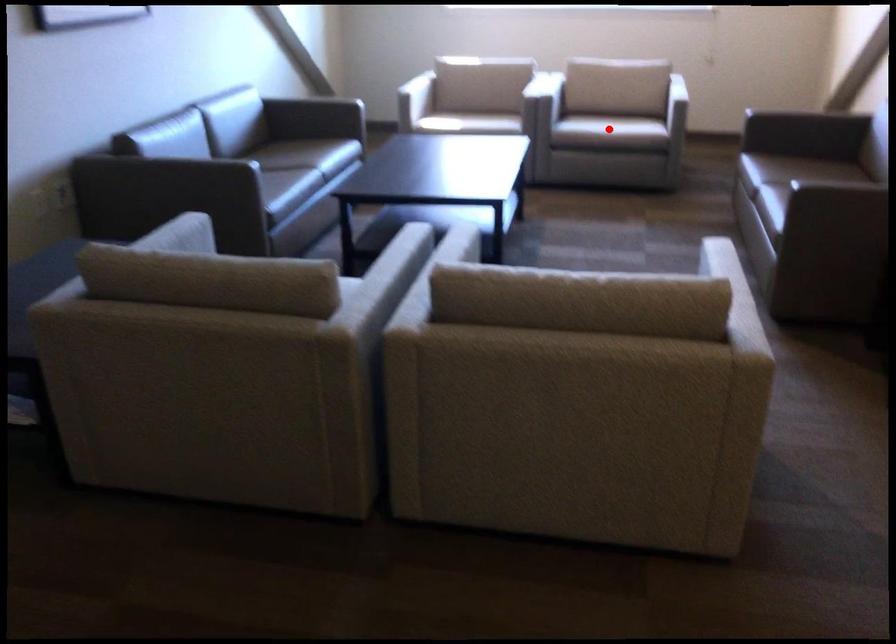
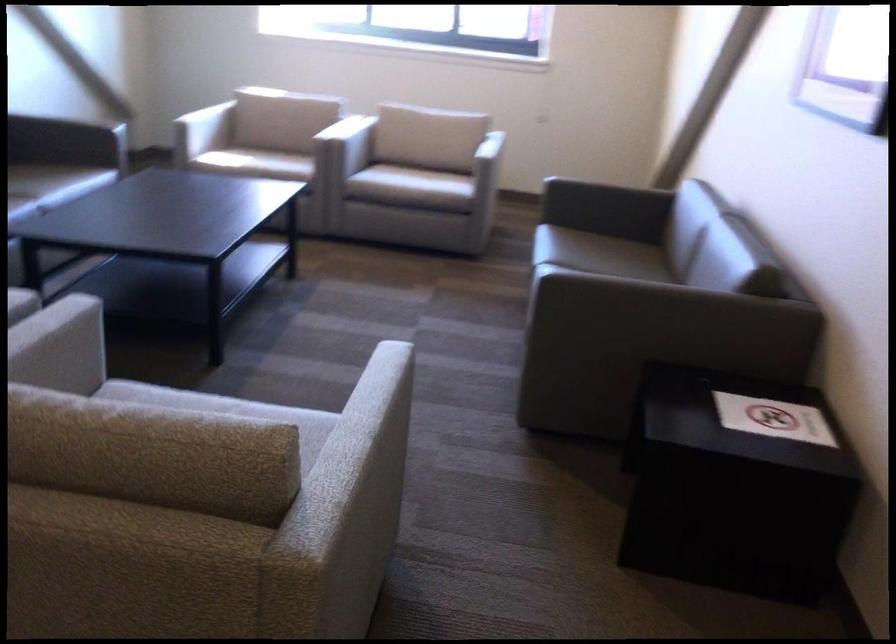
Question: I am providing you with two images of the same scene from different viewpoints. In image1, a red point is highlighted. Considering the same 3D point in image2, which of the following is correct?

Choices:
 (A) It is closer
 (B) It is farther

Answer: (A)